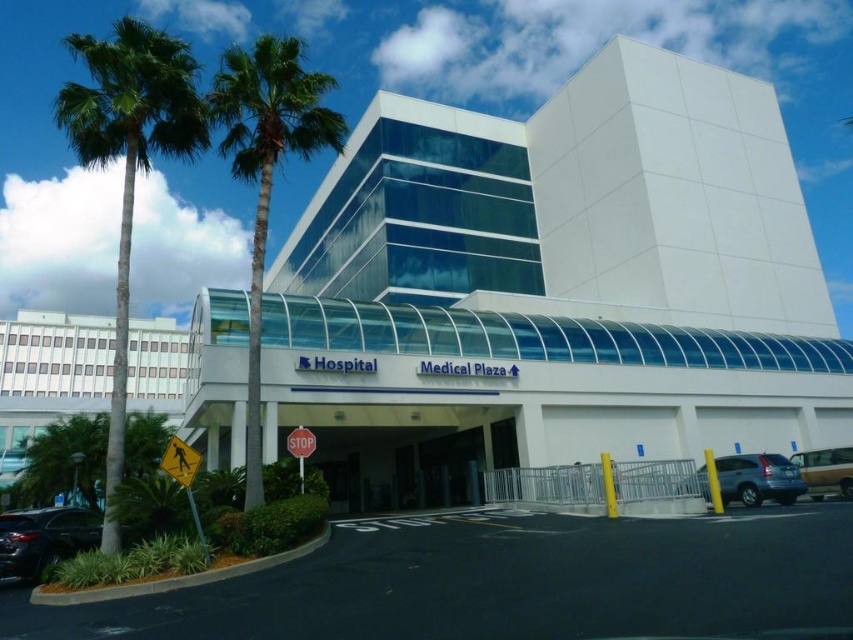
Based on the photo, you are a pedestrian approaching the hospital entrance and see the matte gray suv at lower right and the metallic silver van at lower right. Which vehicle is closer to the left side of the entrance?

The matte gray suv at lower right is positioned on the left side of the metallic silver van at lower right, so it is closer to the left side of the entrance.